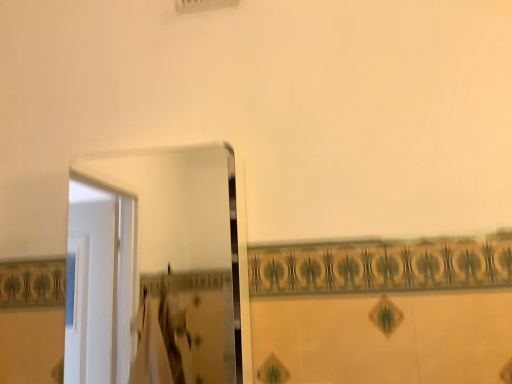
The height and width of the screenshot is (384, 512). I want to click on clear glass mirror at upper center, so click(184, 251).

What do you see at coordinates (184, 251) in the screenshot? I see `clear glass mirror at upper center` at bounding box center [184, 251].

Locate an element on the screen. The height and width of the screenshot is (384, 512). clear glass mirror at upper center is located at coordinates (184, 251).